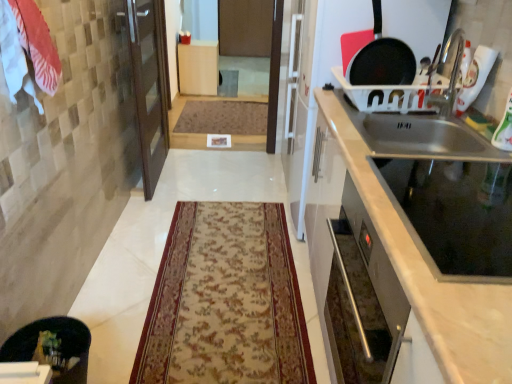
This screenshot has height=384, width=512. I want to click on free point below white cotton towel at upper left (from a real-world perspective), so click(82, 302).